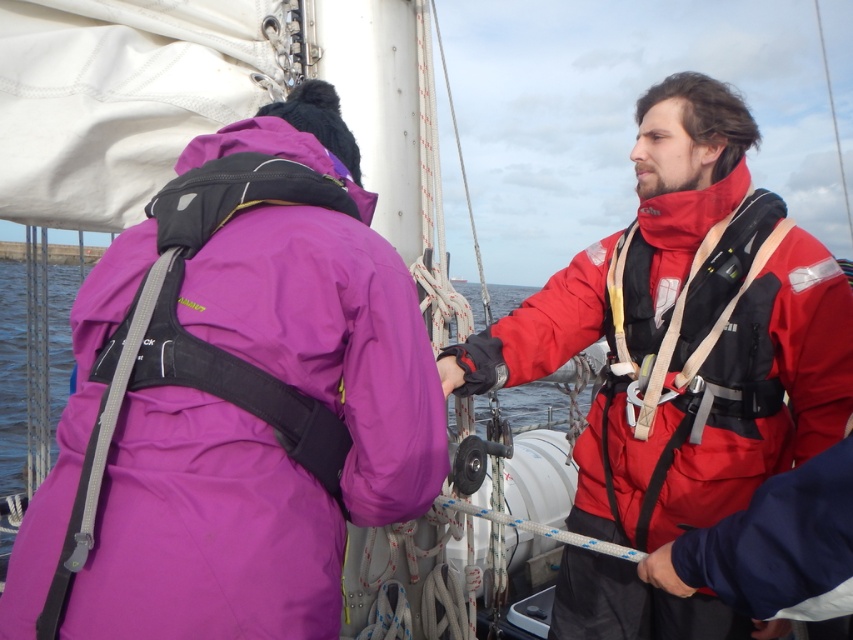
Based on the photo, is purple matte jacket at upper left further to camera compared to red matte life vest at center?

No, purple matte jacket at upper left is closer to the viewer.

Which is in front, point (115, 625) or point (738, 300)?

Positioned in front is point (115, 625).

Does point (136, 456) come closer to viewer compared to point (618, 499)?

Yes.

This screenshot has width=853, height=640. I want to click on purple matte jacket at upper left, so click(206, 531).

Is the position of red matte life vest at center more distant than that of transparent water at center?

That is False.

Between point (685, 104) and point (483, 419), which one is positioned behind?

Point (483, 419)

Does point (802, 275) come in front of point (506, 301)?

That is True.

The width and height of the screenshot is (853, 640). What are the coordinates of `red matte life vest at center` in the screenshot? It's located at (685, 332).

How much distance is there between purple matte jacket at upper left and transparent water at center?

2.29 meters

What do you see at coordinates (206, 531) in the screenshot? I see `purple matte jacket at upper left` at bounding box center [206, 531].

From the picture: Who is more distant from viewer, (300, 577) or (511, 417)?

The point (511, 417) is behind.

This screenshot has width=853, height=640. I want to click on purple matte jacket at upper left, so click(206, 531).